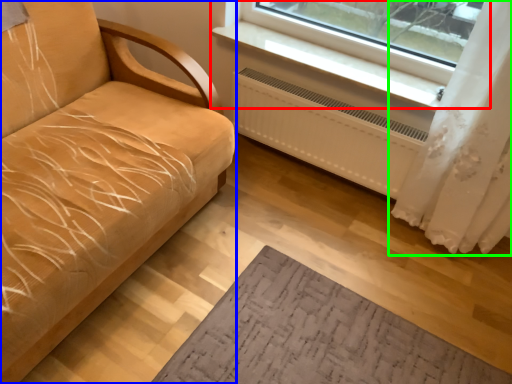
Question: Based on their relative distances, which object is farther from window (highlighted by a red box)? Choose from studio couch (highlighted by a blue box) and curtain (highlighted by a green box).

Choices:
 (A) studio couch
 (B) curtain

Answer: (A)